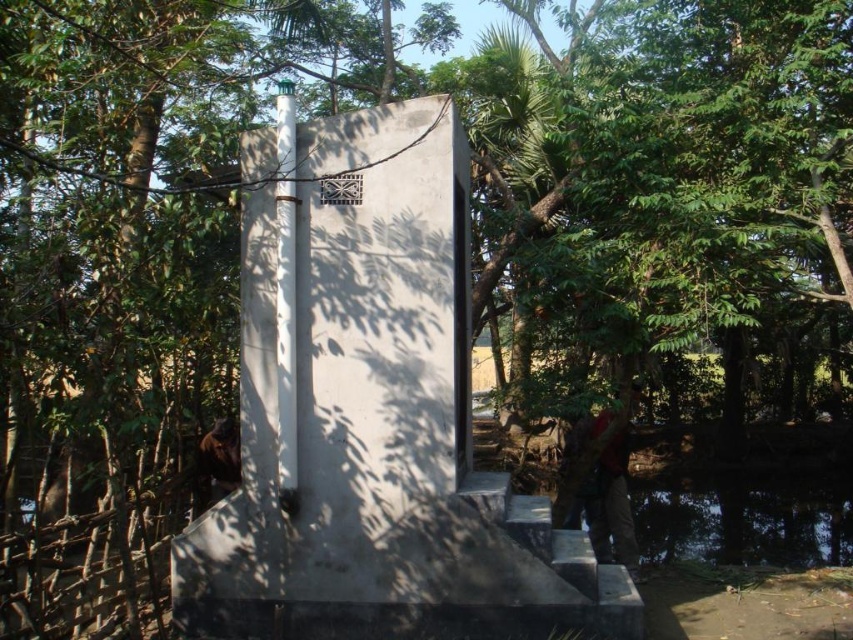
Between point (699, 529) and point (614, 552), which one is positioned in front?

Positioned in front is point (614, 552).

Can you confirm if transparent glass pond at lower right is smaller than red fabric jacket at lower right?

Correct, transparent glass pond at lower right occupies less space than red fabric jacket at lower right.

Identify the location of transparent glass pond at lower right. The image size is (853, 640). [741, 520].

Between red fabric jacket at lower right and brown fur at lower left, which one has more height?

red fabric jacket at lower right is taller.

Image resolution: width=853 pixels, height=640 pixels. What are the coordinates of `red fabric jacket at lower right` in the screenshot? It's located at (611, 504).

The image size is (853, 640). Find the location of `red fabric jacket at lower right`. red fabric jacket at lower right is located at coordinates pos(611,504).

Who is positioned more to the left, transparent glass pond at lower right or brown fur at lower left?

brown fur at lower left

Which of these two, transparent glass pond at lower right or brown fur at lower left, stands taller?

brown fur at lower left

This screenshot has width=853, height=640. I want to click on transparent glass pond at lower right, so click(x=741, y=520).

I want to click on transparent glass pond at lower right, so click(x=741, y=520).